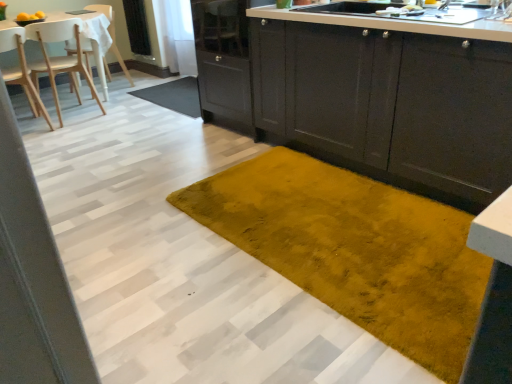
Question: From the image's perspective, is wooden chair at left, placed as the 2th chair when sorted from back to front, positioned above or below white wood chair at upper left, the 1th chair viewed from the back?

Choices:
 (A) below
 (B) above

Answer: (A)

Question: In terms of size, does wooden chair at left, the 2th chair from the front, appear bigger or smaller than white wood chair at upper left, which is counted as the third chair, starting from the front?

Choices:
 (A) small
 (B) big

Answer: (A)

Question: Based on their relative distances, which object is nearer to the metallic silver faucet at upper right?

Choices:
 (A) white glossy countertop at upper center
 (B) transparent glass screen door at upper center
 (C) wooden chair at left, the 2th chair from the front
 (D) matte dark gray cabinets at center
 (E) velvet yellow rug at center, which is counted as the 2th doormat, starting from the top

Answer: (A)

Question: Which is farther from the mustard yellow plush rug at center, the 1th doormat when ordered from back to front?

Choices:
 (A) matte dark gray cabinets at center
 (B) metallic silver faucet at upper right
 (C) transparent glass screen door at upper center
 (D) light wood chair at left, positioned as the 3th chair in back-to-front order
 (E) velvet yellow rug at center, acting as the 1th doormat starting from the bottom

Answer: (B)